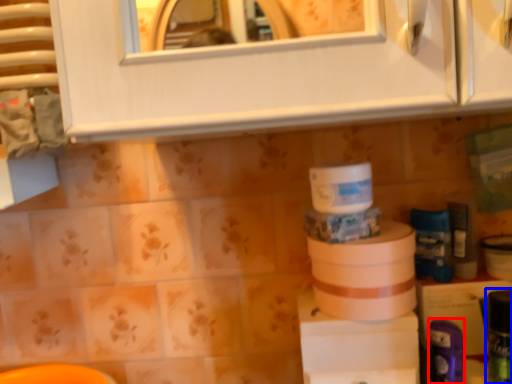
Question: Among these objects, which one is farthest to the camera, toiletry (highlighted by a red box) or toiletry (highlighted by a blue box)?

Choices:
 (A) toiletry
 (B) toiletry

Answer: (A)